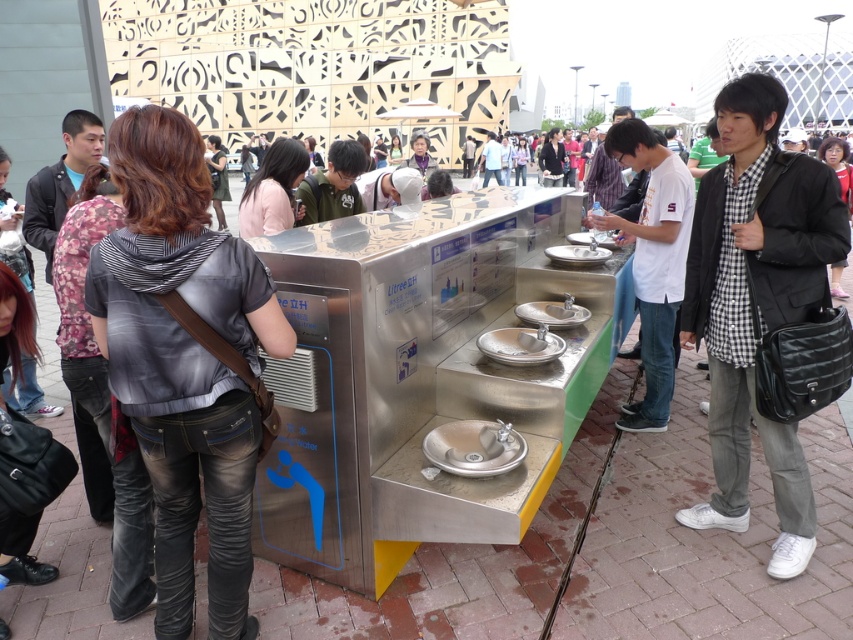
From the picture: You are standing at the public drinking fountain area and see the denim jacket at center. If you want to pick up the jacket, which direction should you move relative to your current position?

The denim jacket at center is located at point (184, 362), so you should move towards the center of the scene to pick it up.

You are a maintenance worker inspecting the stainless steel water fountain at center and the checkered shirt at center. Which object is shorter?

The stainless steel water fountain at center is not as tall as the checkered shirt at center, so the stainless steel water fountain at center is shorter.